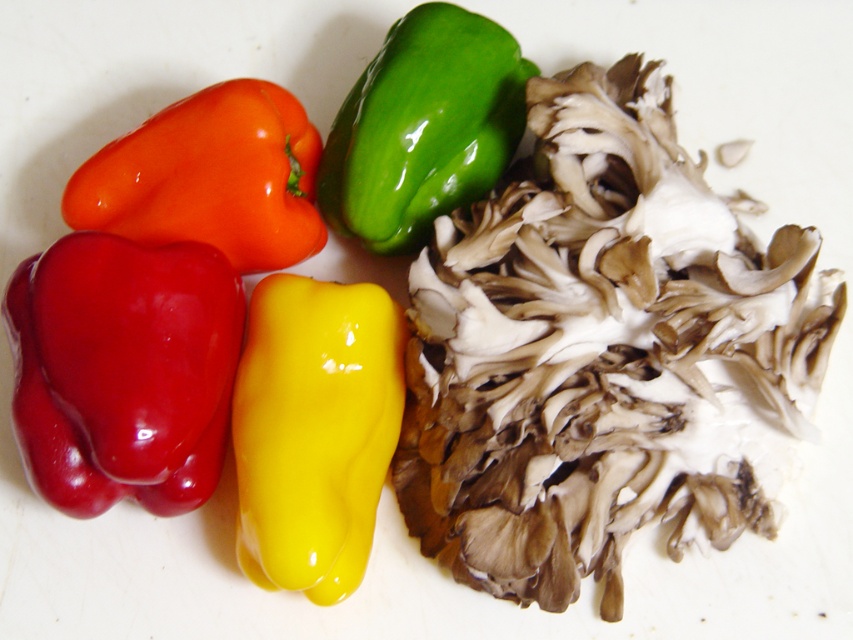
You are a chef preparing a dish and need to choose between the glossy yellow pepper at center and the glossy plastic bell pepper at upper left. Which one is thinner and better suited for slicing thinly?

The glossy yellow pepper at center is thinner than the glossy plastic bell pepper at upper left, making it better suited for slicing thinly.

You are a chef standing at a counter where the image is displayed. You need to reach for the green glossy bell pepper at upper left. Considering your arm can extend 3 feet, can you comfortably reach it without moving your position?

The green glossy bell pepper at upper left is 4.27 feet away from the viewer. Since your arm can only extend 3 feet, you cannot comfortably reach it without moving your position.